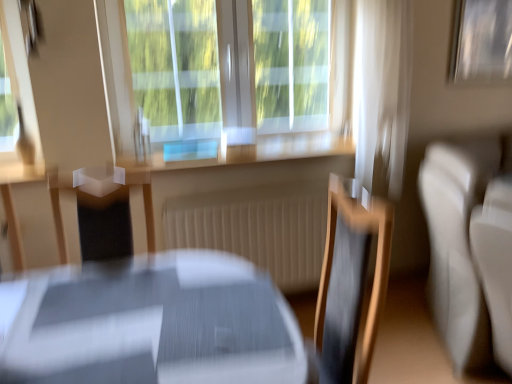
Question: Is metallic silver picture frame at upper right, arranged as the second picture frame when viewed from the left, taller or shorter than matte gray table at center?

Choices:
 (A) tall
 (B) short

Answer: (B)

Question: Is metallic silver picture frame at upper right, arranged as the second picture frame when viewed from the left, in front of or behind matte gray table at center in the image?

Choices:
 (A) behind
 (B) front

Answer: (A)

Question: Estimate the real-world distances between objects in this image. Which object is closer to the metallic silver picture frame at upper right, which is the second picture frame from front to back?

Choices:
 (A) wooden at center
 (B) white sheer curtain at upper right
 (C) metallic silver picture frame at upper left, which appears as the second picture frame when viewed from the right
 (D) matte gray table at center
 (E) transparent glass window at center

Answer: (B)

Question: Considering the real-world distances, which object is farthest from the metallic silver picture frame at upper right, which is the second picture frame from front to back?

Choices:
 (A) white leather couch at right
 (B) matte gray table at center
 (C) metallic silver picture frame at upper left, marked as the 1th picture frame in a front-to-back arrangement
 (D) transparent glass window at center
 (E) wooden at center

Answer: (C)